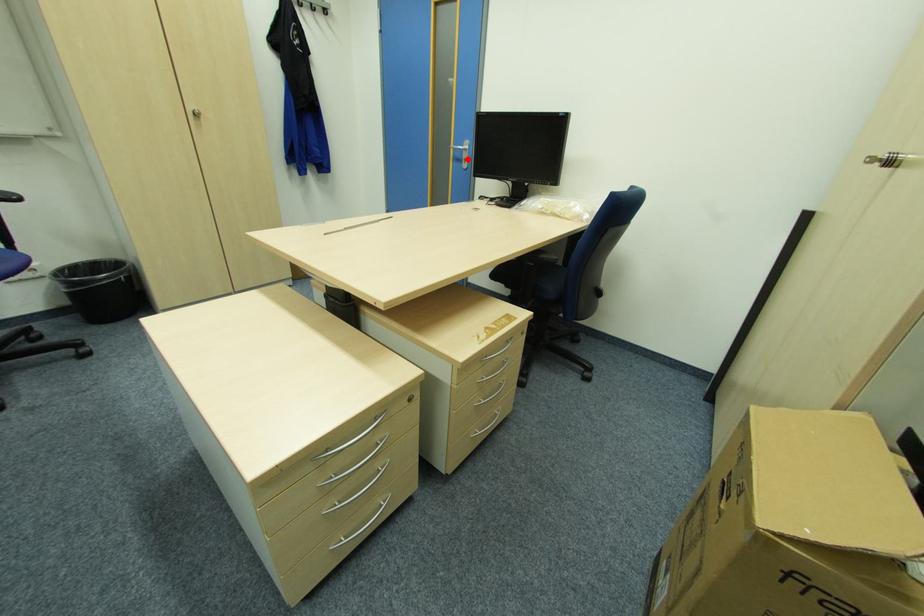
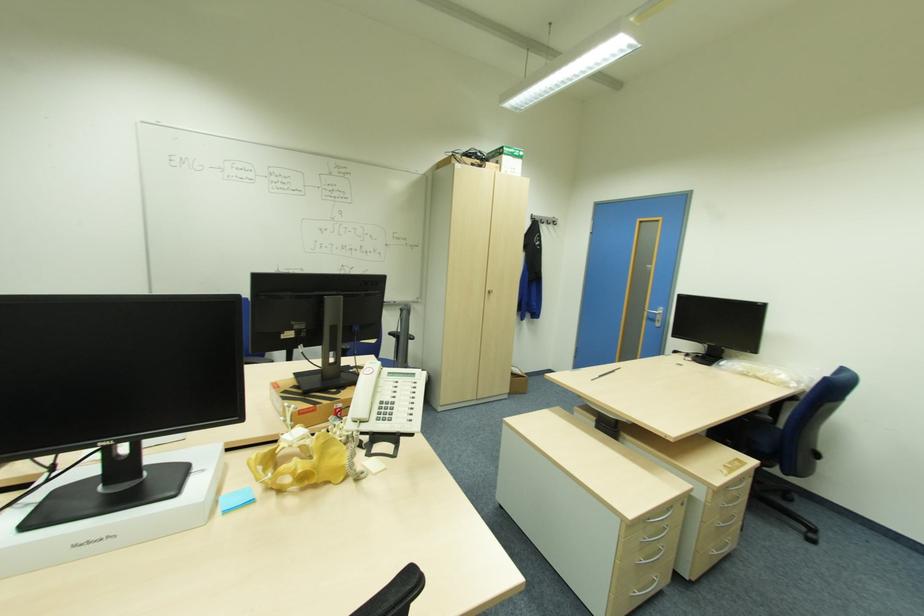
Where in the second image is the point corresponding to the highlighted location from the first image?

(661, 321)